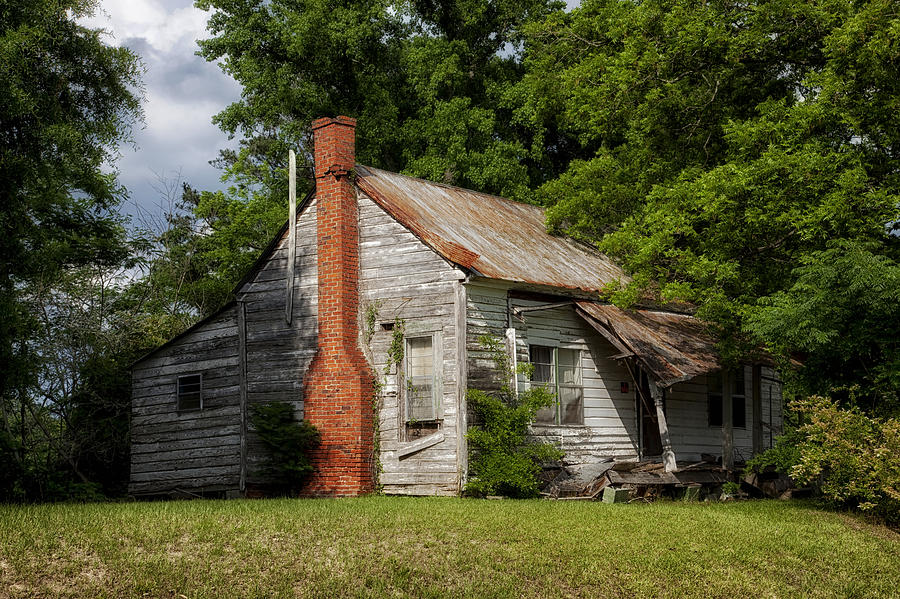
The height and width of the screenshot is (599, 900). Identify the location of door. (652, 434).